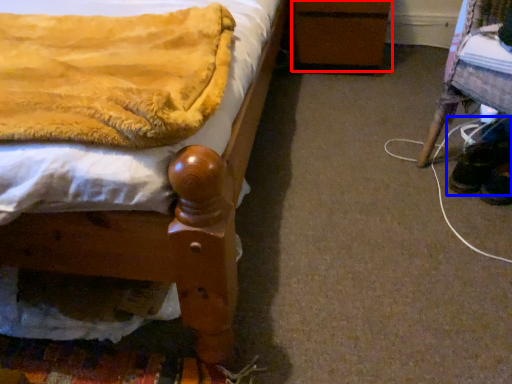
Question: Which point is closer to the camera, changing table (highlighted by a red box) or footwear (highlighted by a blue box)?

Choices:
 (A) changing table
 (B) footwear

Answer: (B)